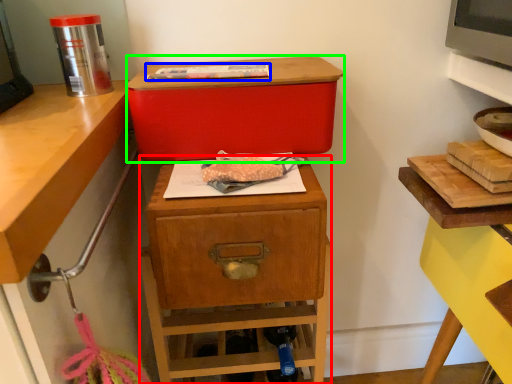
Question: Considering the real-world distances, which object is farthest from nightstand (highlighted by a red box)? food (highlighted by a blue box) or storage box (highlighted by a green box)?

Choices:
 (A) food
 (B) storage box

Answer: (A)